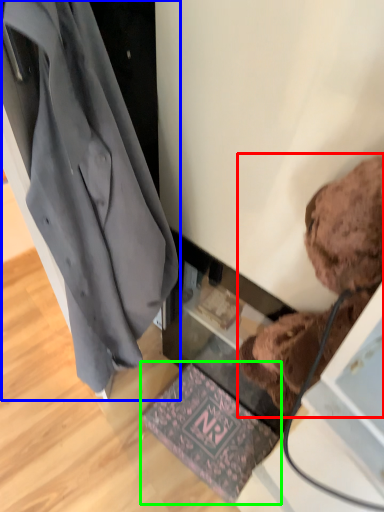
Question: Based on their relative distances, which object is farther from teddy bear (highlighted by a red box)? Choose from coat (highlighted by a blue box) and mat (highlighted by a green box).

Choices:
 (A) coat
 (B) mat

Answer: (B)